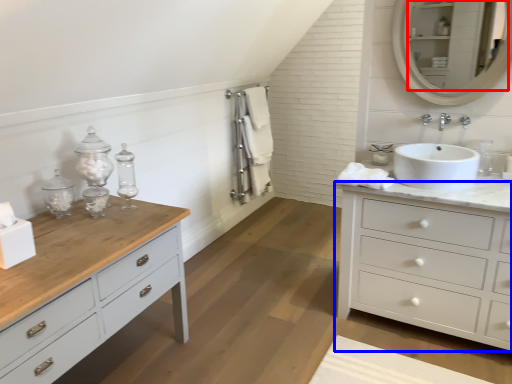
Question: Among these objects, which one is nearest to the camera, mirror (highlighted by a red box) or chest of drawers (highlighted by a blue box)?

Choices:
 (A) mirror
 (B) chest of drawers

Answer: (B)